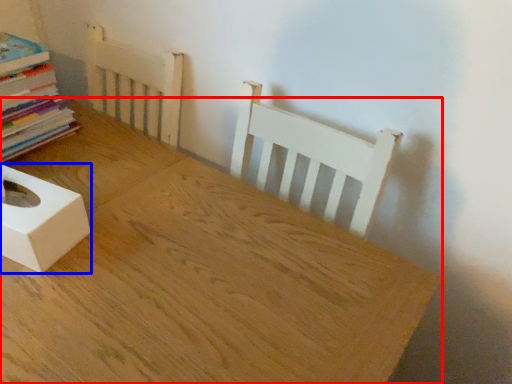
Question: Among these objects, which one is farthest to the camera, table (highlighted by a red box) or box (highlighted by a blue box)?

Choices:
 (A) table
 (B) box

Answer: (B)